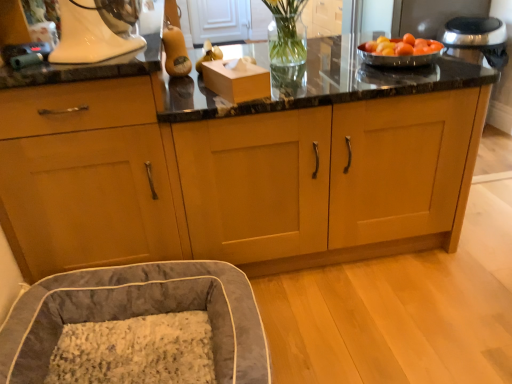
Question: From the image's perspective, is velvet gray bean bag at lower left above white glossy stand mixer at upper left?

Choices:
 (A) yes
 (B) no

Answer: (B)

Question: Is white glossy stand mixer at upper left surrounded by velvet gray bean bag at lower left?

Choices:
 (A) yes
 (B) no

Answer: (B)

Question: Is velvet gray bean bag at lower left bigger than white glossy stand mixer at upper left?

Choices:
 (A) yes
 (B) no

Answer: (A)

Question: Considering the relative sizes of velvet gray bean bag at lower left and white glossy stand mixer at upper left in the image provided, is velvet gray bean bag at lower left taller than white glossy stand mixer at upper left?

Choices:
 (A) no
 (B) yes

Answer: (B)

Question: Would you say velvet gray bean bag at lower left is outside white glossy stand mixer at upper left?

Choices:
 (A) yes
 (B) no

Answer: (A)

Question: Based on their sizes in the image, would you say white glossy stand mixer at upper left is bigger or smaller than silver metallic bowl at upper right?

Choices:
 (A) small
 (B) big

Answer: (B)

Question: From the image's perspective, relative to silver metallic bowl at upper right, is white glossy stand mixer at upper left above or below?

Choices:
 (A) below
 (B) above

Answer: (B)

Question: From a real-world perspective, is white glossy stand mixer at upper left physically located above or below silver metallic bowl at upper right?

Choices:
 (A) below
 (B) above

Answer: (B)

Question: Would you say white glossy stand mixer at upper left is inside or outside silver metallic bowl at upper right?

Choices:
 (A) inside
 (B) outside

Answer: (B)

Question: From a real-world perspective, is matte wood cabinet at lower left, which ranks as the first cabinetry in left-to-right order, physically located above or below white glossy stand mixer at upper left?

Choices:
 (A) below
 (B) above

Answer: (A)

Question: Relative to white glossy stand mixer at upper left, is matte wood cabinet at lower left, which ranks as the first cabinetry in left-to-right order, in front or behind?

Choices:
 (A) front
 (B) behind

Answer: (B)

Question: Is matte wood cabinet at lower left, which appears as the 2th cabinetry when viewed from the right, taller or shorter than white glossy stand mixer at upper left?

Choices:
 (A) short
 (B) tall

Answer: (B)

Question: Is matte wood cabinet at lower left, which appears as the 2th cabinetry when viewed from the right, wider or thinner than white glossy stand mixer at upper left?

Choices:
 (A) thin
 (B) wide

Answer: (B)

Question: Based on their positions, is velvet gray bean bag at lower left located to the left or right of matte wood cabinet at lower left, which ranks as the first cabinetry in left-to-right order?

Choices:
 (A) left
 (B) right

Answer: (B)

Question: Looking at their shapes, would you say velvet gray bean bag at lower left is wider or thinner than matte wood cabinet at lower left, which appears as the 2th cabinetry when viewed from the right?

Choices:
 (A) thin
 (B) wide

Answer: (B)